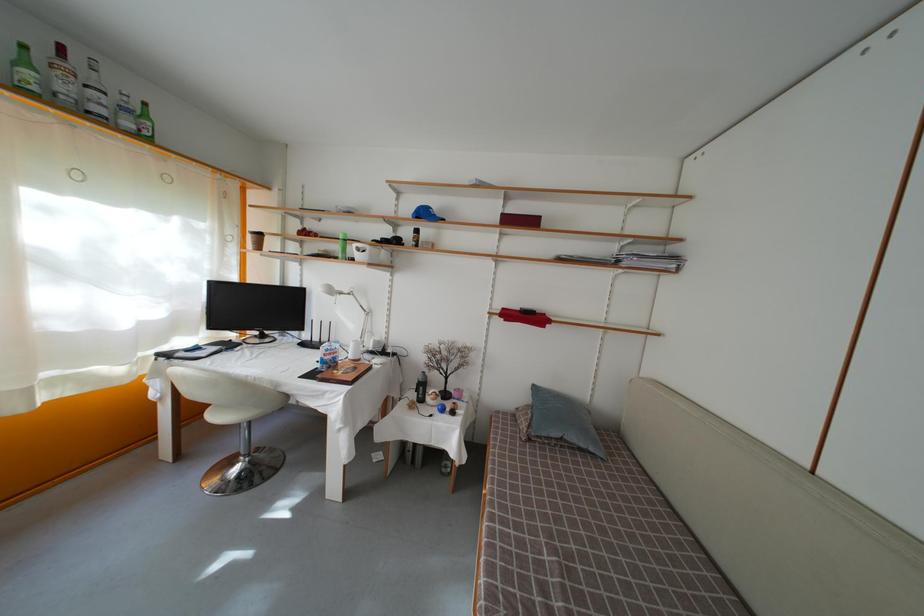
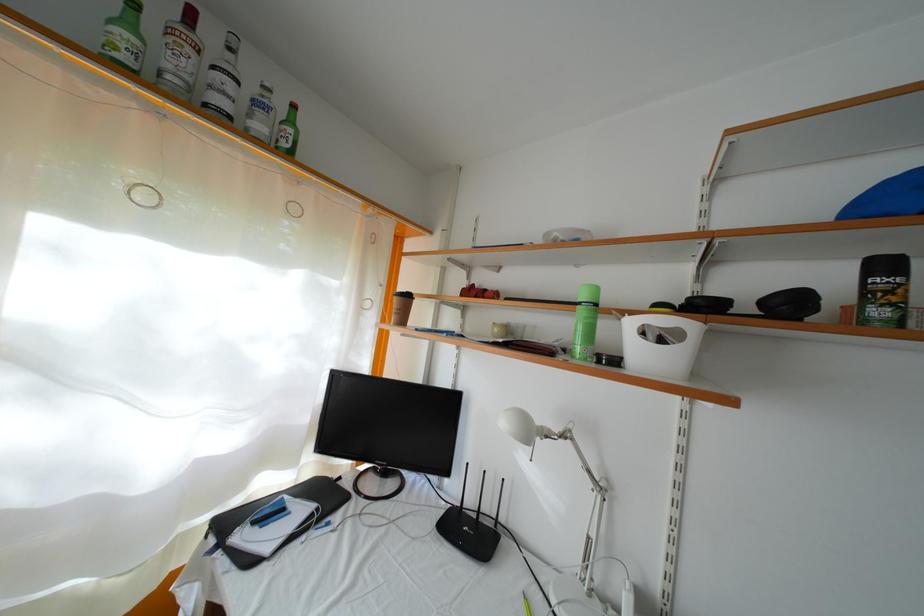
Where in the second image is the point corresponding to (x=234, y=352) from the first image?

(334, 506)